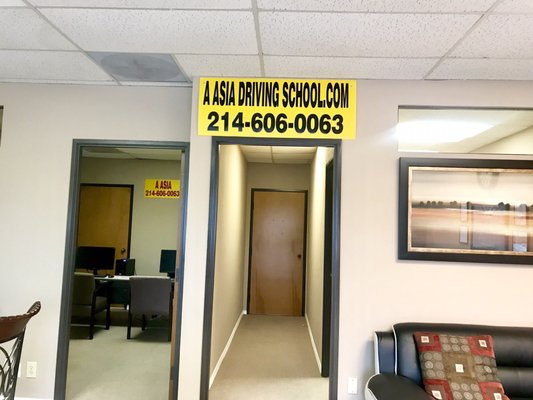
Find the location of `pillw`. pillw is located at coordinates (453, 357).